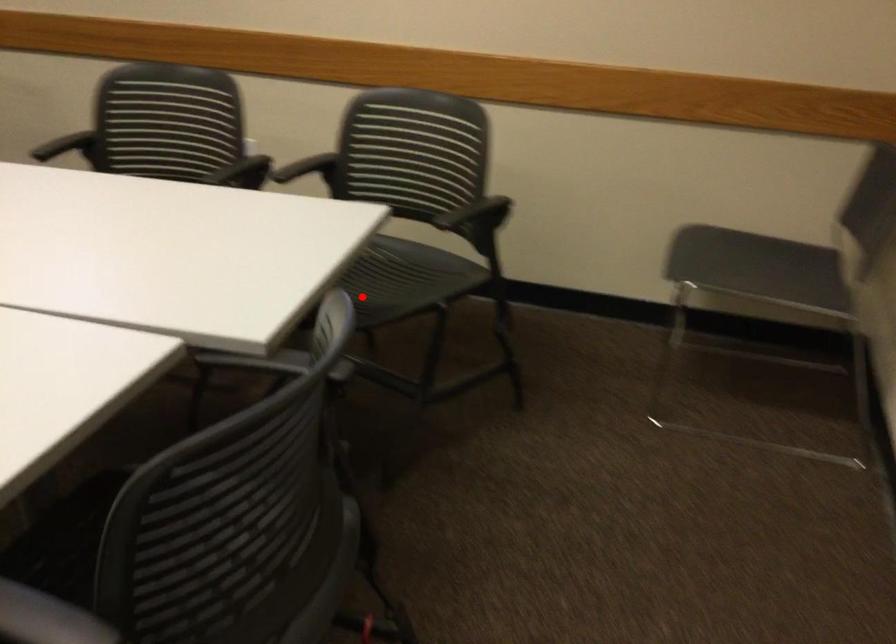
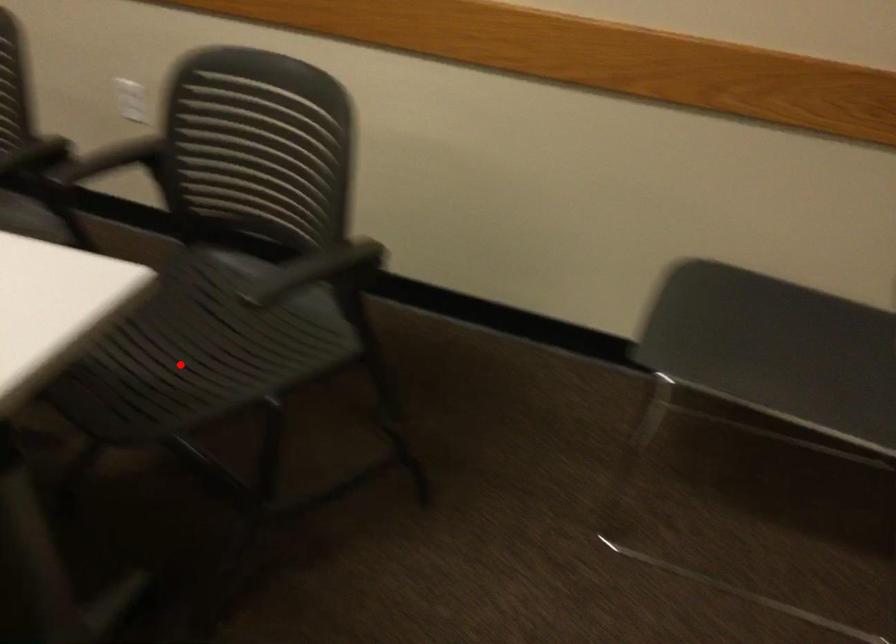
I am providing you with two images of the same scene from different viewpoints. A red point is marked on the first image and another point is marked on the second image. Is the red point in image1 aligned with the point shown in image2?

Yes